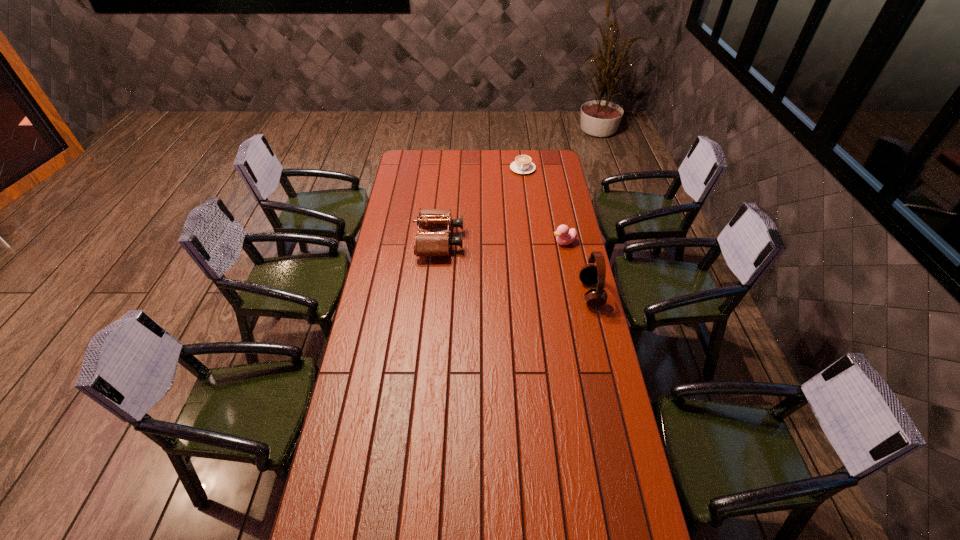
The height and width of the screenshot is (540, 960). Identify the location of the leftmost object. (430, 243).

This screenshot has height=540, width=960. In order to click on the second tallest object in this screenshot , I will do `click(430, 243)`.

Locate an element on the screen. This screenshot has height=540, width=960. the tallest object is located at coordinates point(590,274).

The image size is (960, 540). What are the coordinates of `the nearest object` in the screenshot? It's located at [590, 274].

Locate an element on the screen. This screenshot has height=540, width=960. cappuccino is located at coordinates (522, 164).

I want to click on the second object from left to right, so click(522, 164).

Find the location of a particular element. Image resolution: width=960 pixels, height=540 pixels. the second shortest object is located at coordinates (564, 236).

Locate an element on the screen. This screenshot has height=540, width=960. vacant space situated 0.350m through the eyepieces of the second tallest object is located at coordinates (538, 241).

Locate an element on the screen. Image resolution: width=960 pixels, height=540 pixels. free point located on the ear pads of the headset is located at coordinates (493, 293).

The image size is (960, 540). I want to click on vacant space located on the ear pads of the headset, so pos(516,293).